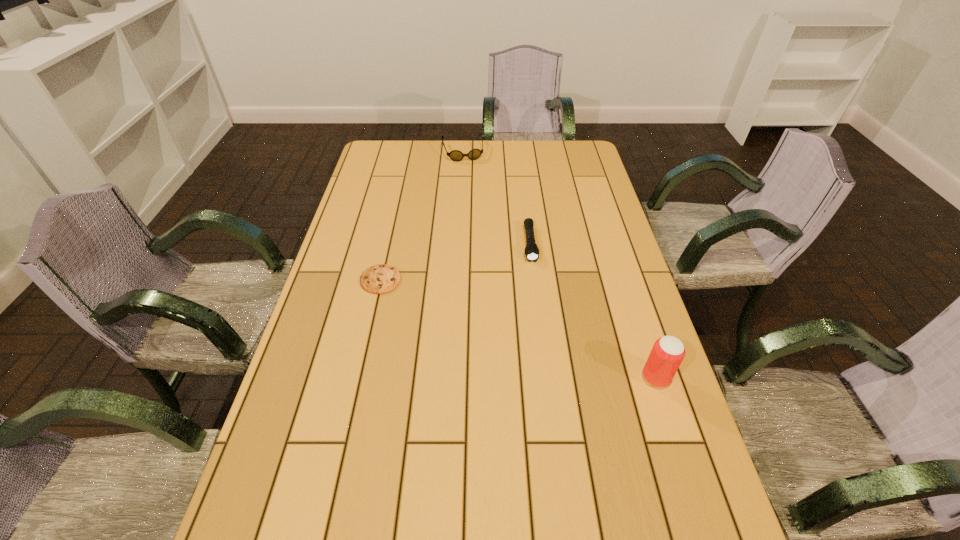
Locate an element on the screen. This screenshot has height=540, width=960. vacant spot on the desktop that is between the leftmost object and the nearest object and is positioned on the lenses of the second tallest object is located at coordinates (506, 324).

Locate an element on the screen. free spot on the desktop that is between the cookie and the tallest object and is positioned at the lens end of the flashlight is located at coordinates 540,336.